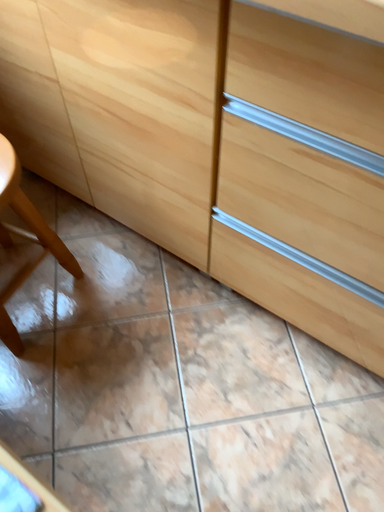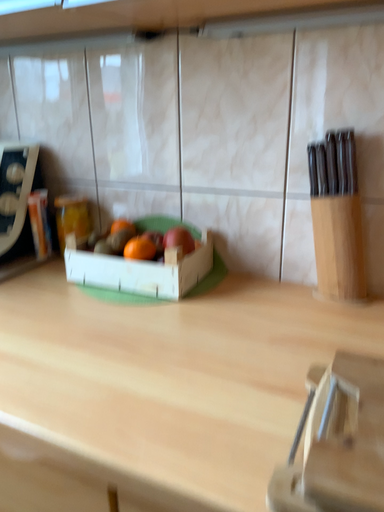
Question: How did the camera likely rotate when shooting the video?

Choices:
 (A) rotated downward
 (B) rotated upward

Answer: (B)